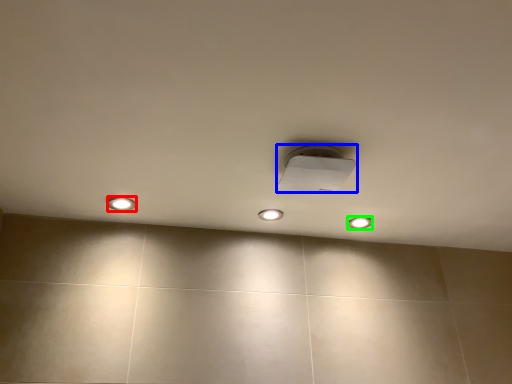
Question: Which object is the farthest from dot (highlighted by a red box)? Choose among these: lamp (highlighted by a blue box) or dot (highlighted by a green box).

Choices:
 (A) lamp
 (B) dot

Answer: (B)